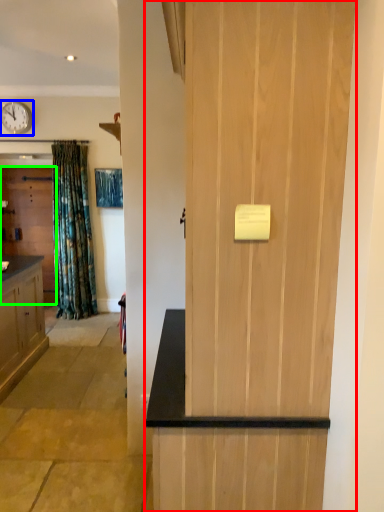
Question: Estimate the real-world distances between objects in this image. Which object is farther from door (highlighted by a red box), clock (highlighted by a blue box) or door (highlighted by a green box)?

Choices:
 (A) clock
 (B) door

Answer: (A)